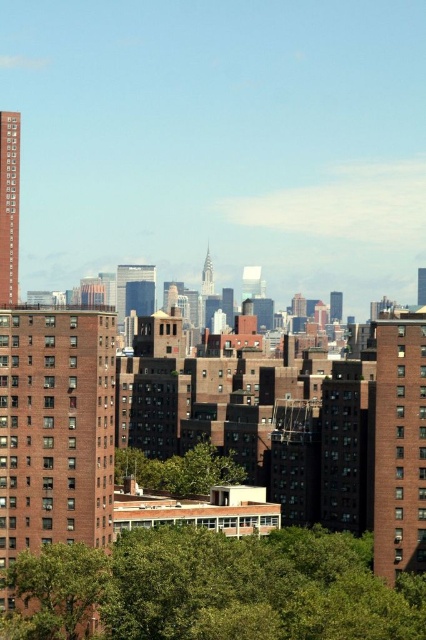
Is green leafy tree at lower left wider than green leafy tree at center?

In fact, green leafy tree at lower left might be narrower than green leafy tree at center.

Measure the distance between point (36, 616) and camera.

A distance of 920.10 feet exists between point (36, 616) and camera.

You are a GUI agent. You are given a task and a screenshot of the screen. Output one action in this format:
    pyautogui.click(x=<x>, y=<y>)
    Task: Click on the green leafy tree at lower left
    
    Given the screenshot: What is the action you would take?
    pyautogui.click(x=54, y=592)

Between green leafy tree at lower center and green leafy tree at lower left, which one appears on the right side from the viewer's perspective?

From the viewer's perspective, green leafy tree at lower center appears more on the right side.

Looking at this image, can you confirm if green leafy tree at lower center is shorter than green leafy tree at lower left?

Correct, green leafy tree at lower center is not as tall as green leafy tree at lower left.

At what (x,y) coordinates should I click in order to perform the action: click on green leafy tree at lower center. Please return your answer as a coordinate pair (x, y). Image resolution: width=426 pixels, height=640 pixels. Looking at the image, I should click on (218, 588).

Where is `green leafy tree at lower center`? green leafy tree at lower center is located at coordinates (218, 588).

Between green leafy tree at lower center and green leafy tree at center, which one has more height?

With more height is green leafy tree at lower center.

Is point (265, 620) positioned after point (201, 460)?

No, it is not.

Locate an element on the screen. This screenshot has width=426, height=640. green leafy tree at lower center is located at coordinates (218, 588).